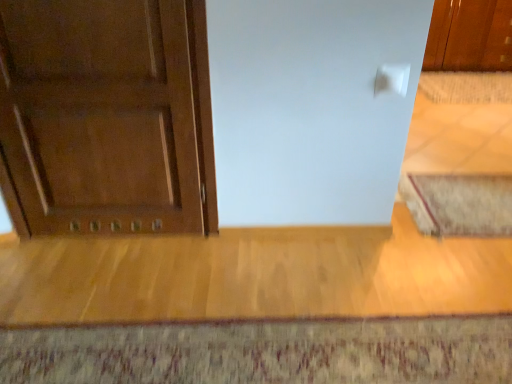
Identify the location of free location to the left of matte wood door at left. (53, 254).